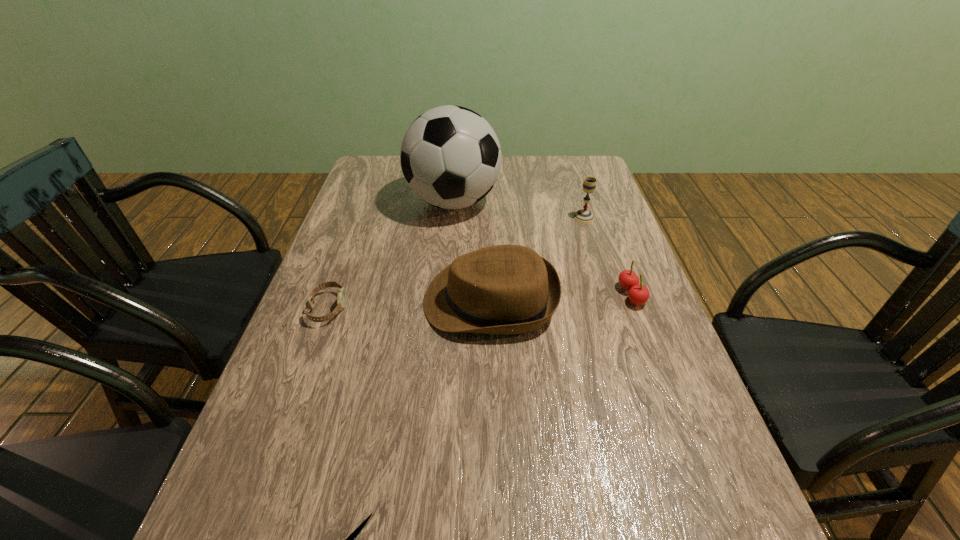
Find the location of a particular element. The image size is (960, 540). vacant point at the far left corner is located at coordinates (360, 177).

In the image, there is a desktop. What are the coordinates of `blank space at the far right corner` in the screenshot? It's located at (587, 165).

Locate an element on the screen. This screenshot has height=540, width=960. blank region between the watch and the tallest object is located at coordinates tap(391, 255).

Where is `free space that is in between the soccer ball and the watch`? This screenshot has height=540, width=960. free space that is in between the soccer ball and the watch is located at coordinates (391, 255).

Where is `vacant space in between the soccer ball and the watch`? Image resolution: width=960 pixels, height=540 pixels. vacant space in between the soccer ball and the watch is located at coordinates (391, 255).

Find the location of a particular element. vacant area between the chalice and the soccer ball is located at coordinates (518, 210).

Locate an element on the screen. This screenshot has width=960, height=540. free space between the chalice and the third shortest object is located at coordinates (608, 256).

Identify the location of object that stands as the second closest to the leftmost object. The height and width of the screenshot is (540, 960). (450, 156).

Image resolution: width=960 pixels, height=540 pixels. In order to click on the fifth closest object to the cherry in this screenshot , I will do `click(351, 539)`.

Identify the location of vacant region that satisfies the following two spatial constraints: 1. on the front side of the chalice; 2. on the left side of the cherry. This screenshot has height=540, width=960. (609, 295).